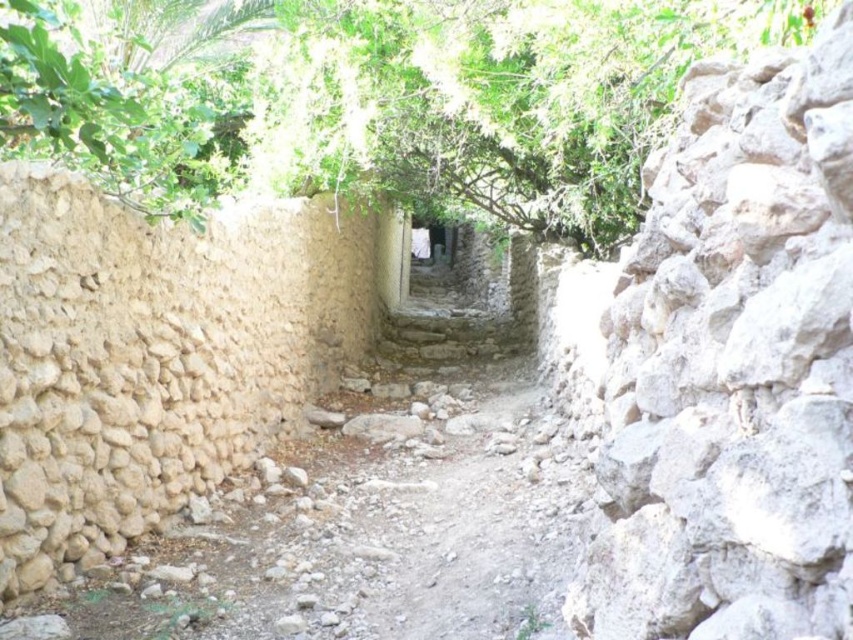
You are standing at the entrance of the narrow alleyway and notice a point marked at coordinates (x=376, y=99). Based on the scene description, what object does this point most likely represent?

The point at (x=376, y=99) corresponds to the green leafy tree at upper center.

You are a painter standing in the middle of the narrow alleyway. You want to paint the green leafy tree at upper center and the gray rough stone wall at right. Which object should you focus on first if you want to paint the larger one first?

The green leafy tree at upper center is bigger than the gray rough stone wall at right, so you should focus on painting the green leafy tree at upper center first.